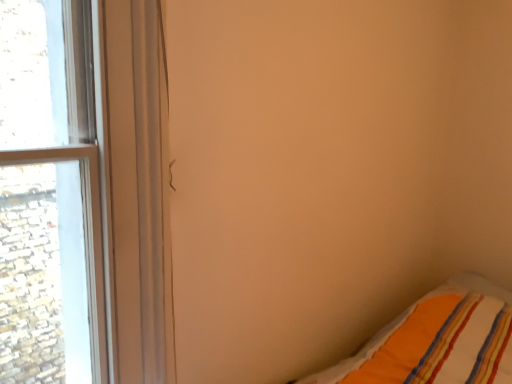
In order to face clear glass window at left, should I rotate leftwards or rightwards?

You should rotate left by 28.701 degrees.

Describe the element at coordinates (50, 197) in the screenshot. This screenshot has height=384, width=512. I see `clear glass window at left` at that location.

Where is `clear glass window at left`? Image resolution: width=512 pixels, height=384 pixels. clear glass window at left is located at coordinates (50, 197).

Where is `clear glass window at left`? This screenshot has height=384, width=512. clear glass window at left is located at coordinates (50, 197).